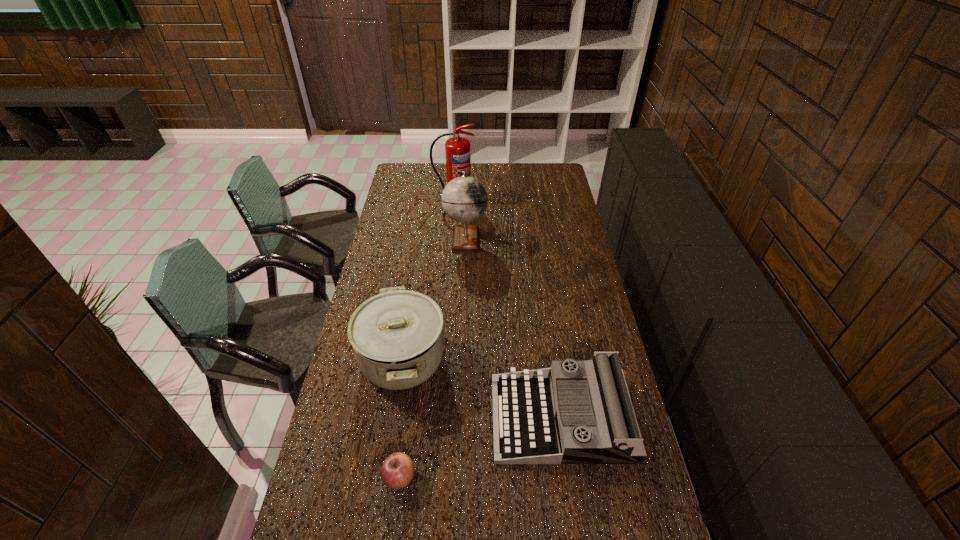
Find the location of a particular element. fire extinguisher is located at coordinates (457, 149).

The image size is (960, 540). I want to click on the tallest object, so click(457, 149).

Image resolution: width=960 pixels, height=540 pixels. I want to click on the fourth nearest object, so click(x=464, y=199).

Image resolution: width=960 pixels, height=540 pixels. Find the location of `the fourth shortest object`. the fourth shortest object is located at coordinates (464, 199).

You are a GUI agent. You are given a task and a screenshot of the screen. Output one action in this format:
    pyautogui.click(x=<x>, y=<y>)
    Task: Click on the saucepan
    This screenshot has width=960, height=540.
    Given the screenshot: What is the action you would take?
    pyautogui.click(x=397, y=336)

Identify the location of the rightmost object. (543, 416).

You are a GUI agent. You are given a task and a screenshot of the screen. Output one action in this format:
    pyautogui.click(x=<x>, y=<y>)
    Task: Click on the fourth tallest object
    
    Given the screenshot: What is the action you would take?
    pyautogui.click(x=543, y=416)

You are a GUI agent. You are given a task and a screenshot of the screen. Output one action in this format:
    pyautogui.click(x=<x>, y=<y>)
    Task: Click on the shortest object
    
    Given the screenshot: What is the action you would take?
    [397, 471]

Where is `free location located on the surface of the fire extinguisher`? The height and width of the screenshot is (540, 960). free location located on the surface of the fire extinguisher is located at coordinates (453, 216).

In order to click on blank area located 0.380m at the equator of the globe in this screenshot , I will do `click(571, 239)`.